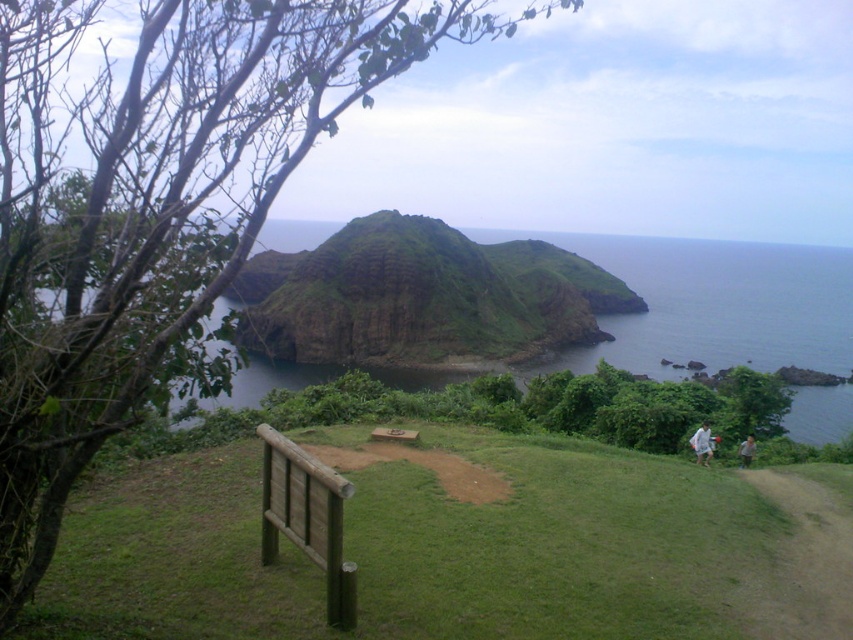
Between green grassy hillside at lower center and light brown fabric shirt at lower right, which one is positioned lower?

light brown fabric shirt at lower right

Is green grassy hillside at lower center positioned in front of light brown fabric shirt at lower right?

Yes, green grassy hillside at lower center is in front of light brown fabric shirt at lower right.

Locate an element on the screen. The height and width of the screenshot is (640, 853). green grassy hillside at lower center is located at coordinates coord(711,305).

I want to click on green grassy hillside at lower center, so click(711, 305).

Does green rock at center appear on the left side of light brown fabric shirt at lower right?

Yes, green rock at center is to the left of light brown fabric shirt at lower right.

Is point (346, 320) less distant than point (741, 444)?

No, it is behind (741, 444).

In order to click on green rock at center in this screenshot , I will do `click(422, 296)`.

Who is lower down, green grassy at center or green grassy hillside at lower center?

green grassy at center

Is green grassy at center positioned behind green grassy hillside at lower center?

That is True.

Where is `green grassy at center`? green grassy at center is located at coordinates (553, 545).